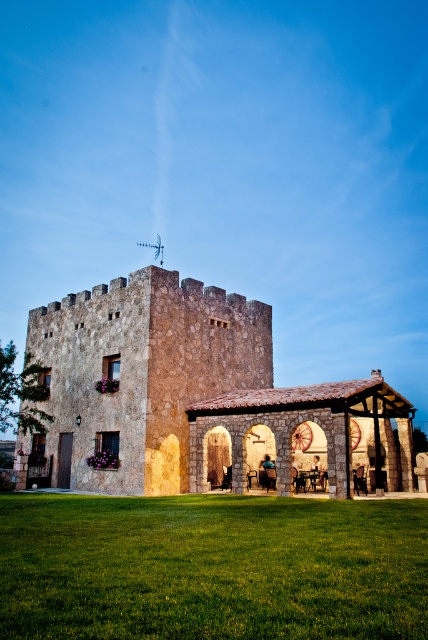
Which is in front, point (259, 625) or point (183, 336)?

Point (259, 625) is in front.

Does green grass at lower center appear on the left side of rustic stone castle at center?

In fact, green grass at lower center is to the right of rustic stone castle at center.

Does point (368, 528) come in front of point (279, 492)?

Yes, point (368, 528) is closer to viewer.

At what (x,y) coordinates should I click in order to perform the action: click on green grass at lower center. Please return your answer as a coordinate pair (x, y). Looking at the image, I should click on (211, 566).